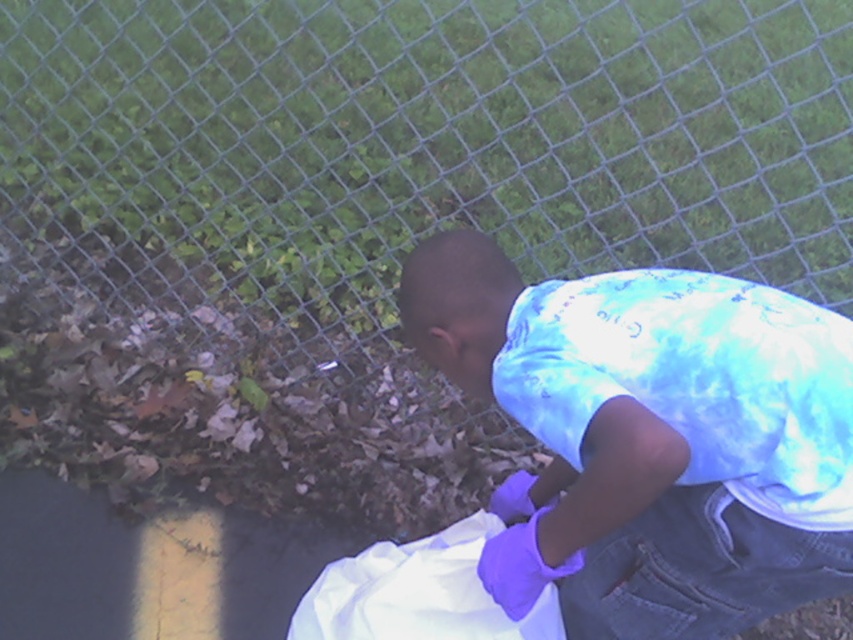
How much distance is there between metallic chain-link fence at upper center and blue tie-dye shirt at center?

metallic chain-link fence at upper center is 4.55 feet from blue tie-dye shirt at center.

Is metallic chain-link fence at upper center shorter than blue tie-dye shirt at center?

Incorrect, metallic chain-link fence at upper center's height does not fall short of blue tie-dye shirt at center's.

You are a GUI agent. You are given a task and a screenshot of the screen. Output one action in this format:
    pyautogui.click(x=<x>, y=<y>)
    Task: Click on the metallic chain-link fence at upper center
    
    Given the screenshot: What is the action you would take?
    pyautogui.click(x=421, y=145)